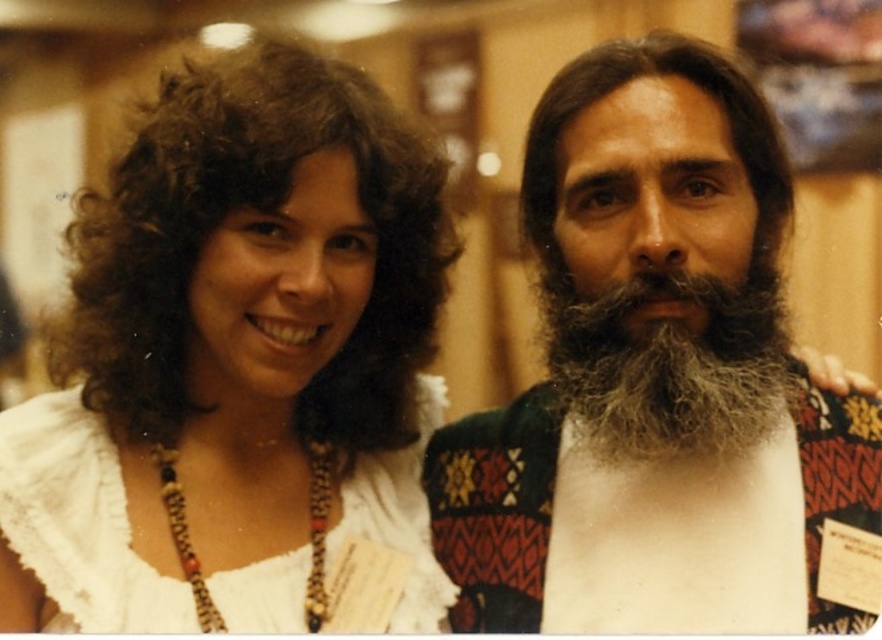
Is white lace dress at center above beaded necklace at center?

Indeed, white lace dress at center is positioned over beaded necklace at center.

The width and height of the screenshot is (882, 640). I want to click on white lace dress at center, so click(79, 522).

Is dark curly hair at left to the right of white lace dress at center from the viewer's perspective?

Yes, dark curly hair at left is to the right of white lace dress at center.

Which is more to the right, dark curly hair at left or white lace dress at center?

Positioned to the right is dark curly hair at left.

Which is in front, point (107, 300) or point (425, 396)?

Point (107, 300) is in front.

Locate an element on the screen. dark curly hair at left is located at coordinates (258, 209).

Who is positioned more to the left, dark curly hair at left or grayish-brown textured beard at center?

From the viewer's perspective, dark curly hair at left appears more on the left side.

Between point (141, 385) and point (716, 454), which one is positioned in front?

Positioned in front is point (141, 385).

Between point (77, 259) and point (675, 388), which one is positioned in front?

Point (675, 388) is more forward.

I want to click on dark curly hair at left, so click(258, 209).